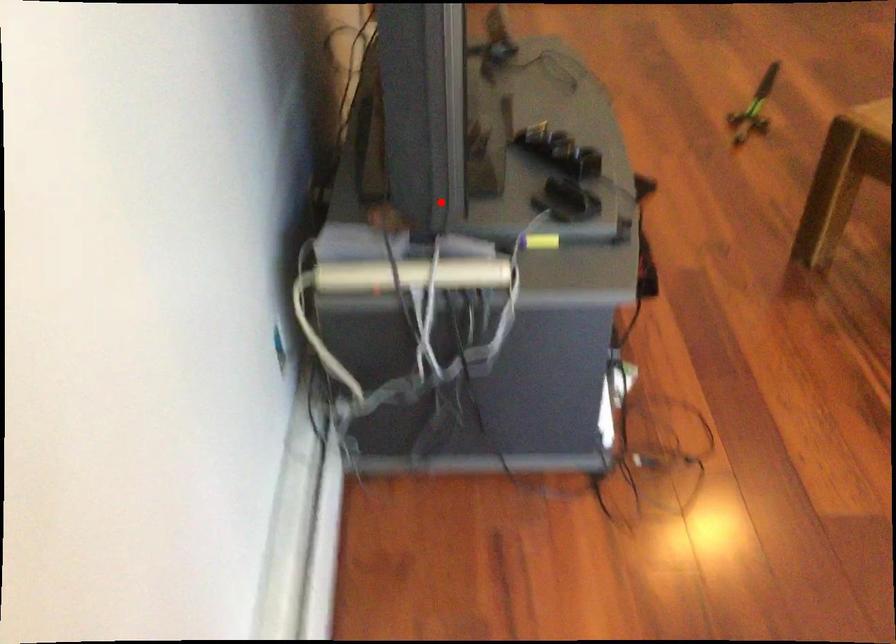
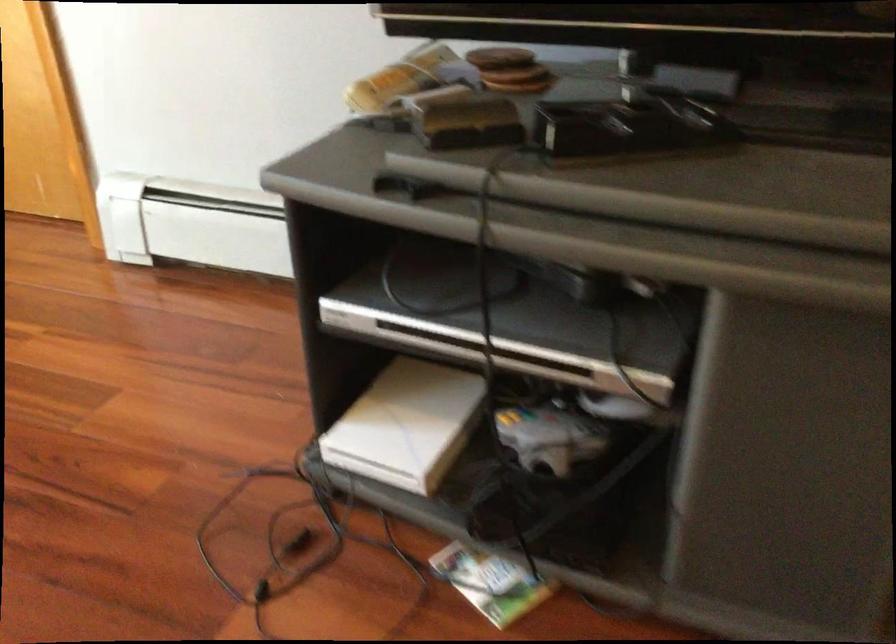
The point at the highlighted location is marked in the first image. Where is the corresponding point in the second image?

(519, 80)